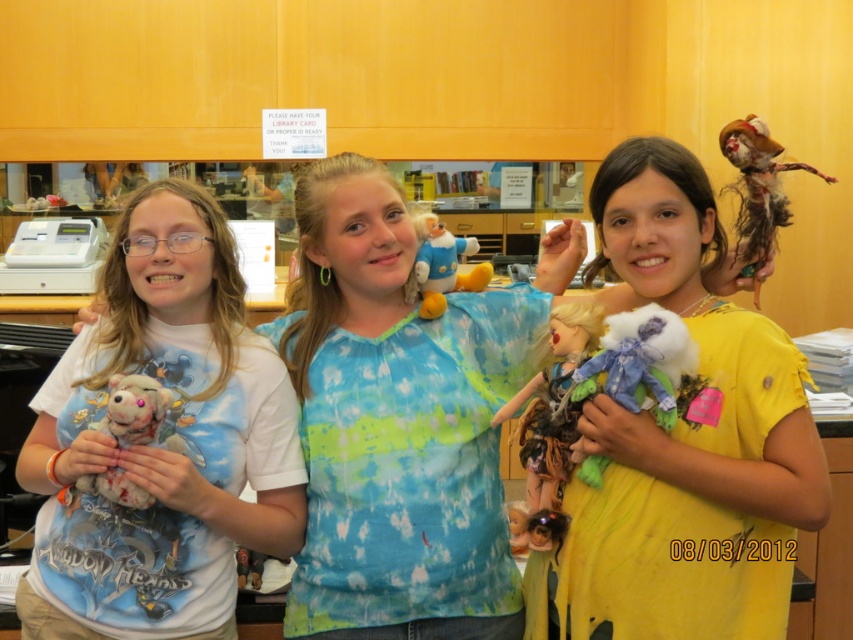
Question: Which of the following is the closest to the observer?

Choices:
 (A) fluffy white teddy bear at left
 (B) matte plastic doll at center
 (C) fluffy plush toy at center

Answer: (A)

Question: Which point is closer to the camera taking this photo?

Choices:
 (A) (439, 577)
 (B) (445, 289)
 (C) (111, 387)

Answer: (C)

Question: Is distressed fabric doll at upper right to the right of fluffy plush toy at center from the viewer's perspective?

Choices:
 (A) no
 (B) yes

Answer: (B)

Question: Which point is closer to the camera?

Choices:
 (A) fluffy plush toy at center
 (B) fluffy fabric stuffed animal at center
 (C) distressed fabric doll at upper right
 (D) matte plastic doll at center

Answer: (B)

Question: Observing the image, what is the correct spatial positioning of tie-dye fabric doll at center in reference to fluffy plush toy at center?

Choices:
 (A) right
 (B) left

Answer: (B)

Question: Observing the image, what is the correct spatial positioning of fluffy fabric stuffed animal at center in reference to matte plastic doll at center?

Choices:
 (A) above
 (B) below

Answer: (A)